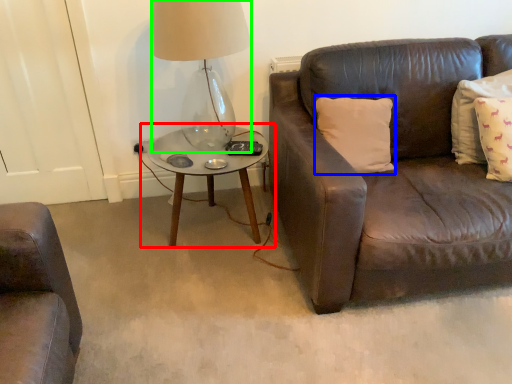
Question: Which object is the closest to the coffee table (highlighted by a red box)? Choose among these: pillow (highlighted by a blue box) or table lamp (highlighted by a green box).

Choices:
 (A) pillow
 (B) table lamp

Answer: (B)